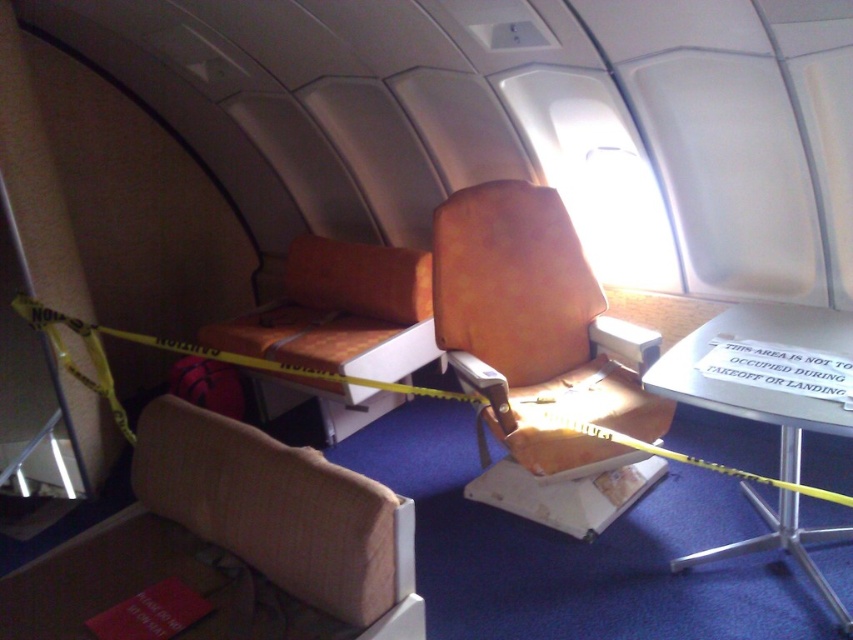
Question: Does leather-like orange armchair at center have a smaller size compared to beige fabric armchair at lower left?

Choices:
 (A) no
 (B) yes

Answer: (A)

Question: Does leather-like orange armchair at center come behind beige fabric armchair at lower left?

Choices:
 (A) yes
 (B) no

Answer: (A)

Question: Can you confirm if leather-like orange armchair at center is positioned to the left of matte orange armchair at center?

Choices:
 (A) no
 (B) yes

Answer: (A)

Question: Which object is farther from the camera taking this photo?

Choices:
 (A) beige fabric armchair at lower left
 (B) leather-like orange armchair at center
 (C) matte orange armchair at center

Answer: (C)

Question: Which point is farther from the camera taking this photo?

Choices:
 (A) (173, 406)
 (B) (434, 291)
 (C) (341, 349)

Answer: (C)

Question: Which point is farther from the camera taking this photo?

Choices:
 (A) (306, 460)
 (B) (531, 208)

Answer: (B)